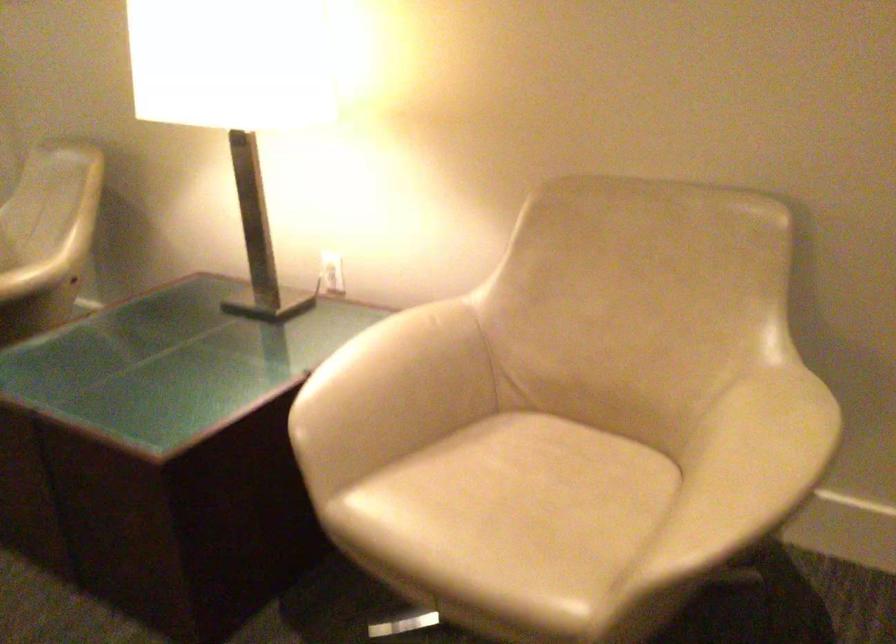
The height and width of the screenshot is (644, 896). What do you see at coordinates (332, 272) in the screenshot?
I see `the white electrical outlet` at bounding box center [332, 272].